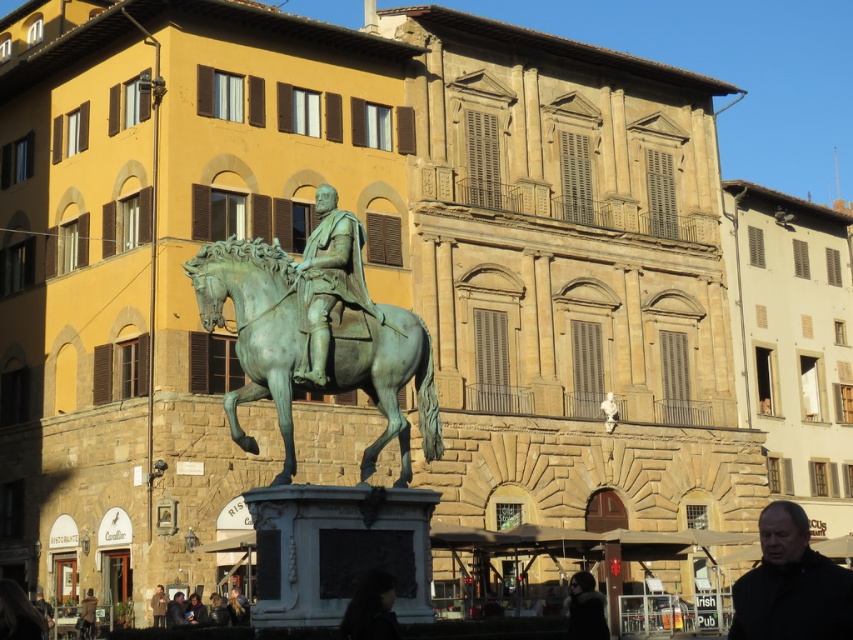
You are a tour guide leading a group near the equestrian statue. You want to ensure that the dark brown leather jacket at lower center is visible to all visitors standing near the green patina horse at center. Given that the average human eye can clearly see objects up to 10 meters away, will the jacket be visible to them?

The distance between the green patina horse at center and the dark brown leather jacket at lower center is 8.20 meters, which is within the 10 meters visibility range. Therefore, the jacket will be visible to visitors standing near the horse.

You are a tourist standing in front of the historical building and see the green patina horse at center and the dark brown leather jacket at lower center. Which object is positioned higher in the scene?

The green patina horse at center is located above the dark brown leather jacket at lower center, so it is positioned higher in the scene.

You are a visitor standing in front of the historical building. You see the green patina horse at center and the black matte jacket at lower right. Which object is closer to you?

The green patina horse at center is closer to you because it is positioned over the black matte jacket at lower right, indicating it is in front.